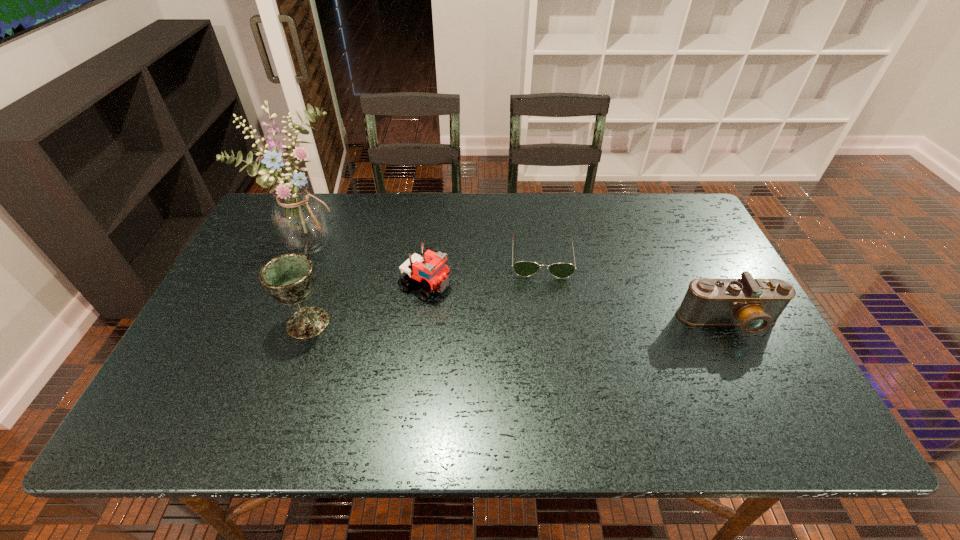
Where is `chalice`? chalice is located at coordinates (289, 278).

Locate an element on the screen. the rightmost object is located at coordinates (754, 305).

At what (x,y) coordinates should I click in order to perform the action: click on sunglasses. Please return your answer as a coordinate pair (x, y). Image resolution: width=960 pixels, height=540 pixels. Looking at the image, I should click on (522, 268).

Image resolution: width=960 pixels, height=540 pixels. Find the location of `the shortest object`. the shortest object is located at coordinates (522, 268).

At what (x,y) coordinates should I click in order to perform the action: click on Lego. Please return your answer as a coordinate pair (x, y). The height and width of the screenshot is (540, 960). Looking at the image, I should click on pyautogui.click(x=428, y=269).

The height and width of the screenshot is (540, 960). Identify the location of bouquet. (300, 219).

Identify the location of vacant region located on the back of the fourth shortest object. The height and width of the screenshot is (540, 960). (338, 238).

Where is `vacant region located 0.140m on the lens of the rightmost object`? vacant region located 0.140m on the lens of the rightmost object is located at coordinates (765, 392).

Image resolution: width=960 pixels, height=540 pixels. Identify the location of free point located on the front-facing side of the sunglasses. (544, 318).

Identify the location of free space located 0.300m on the front-facing side of the sunglasses. (547, 372).